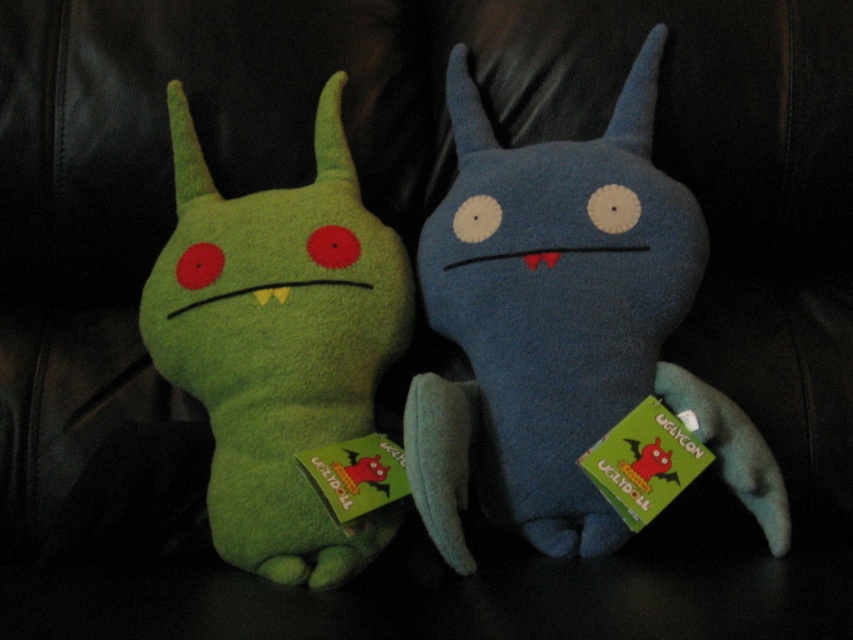
Question: Which object is farther from the camera taking this photo?

Choices:
 (A) green plush toy at left
 (B) blue plush toy at center

Answer: (A)

Question: Which object appears farthest from the camera in this image?

Choices:
 (A) green plush toy at left
 (B) blue plush toy at center

Answer: (A)

Question: Where is blue plush toy at center located in relation to green plush toy at left in the image?

Choices:
 (A) right
 (B) left

Answer: (A)

Question: Does blue plush toy at center appear on the left side of green plush toy at left?

Choices:
 (A) no
 (B) yes

Answer: (A)

Question: Which of the following is the closest to the observer?

Choices:
 (A) green plush toy at left
 (B) blue plush toy at center

Answer: (B)

Question: Does blue plush toy at center have a lesser width compared to green plush toy at left?

Choices:
 (A) no
 (B) yes

Answer: (A)